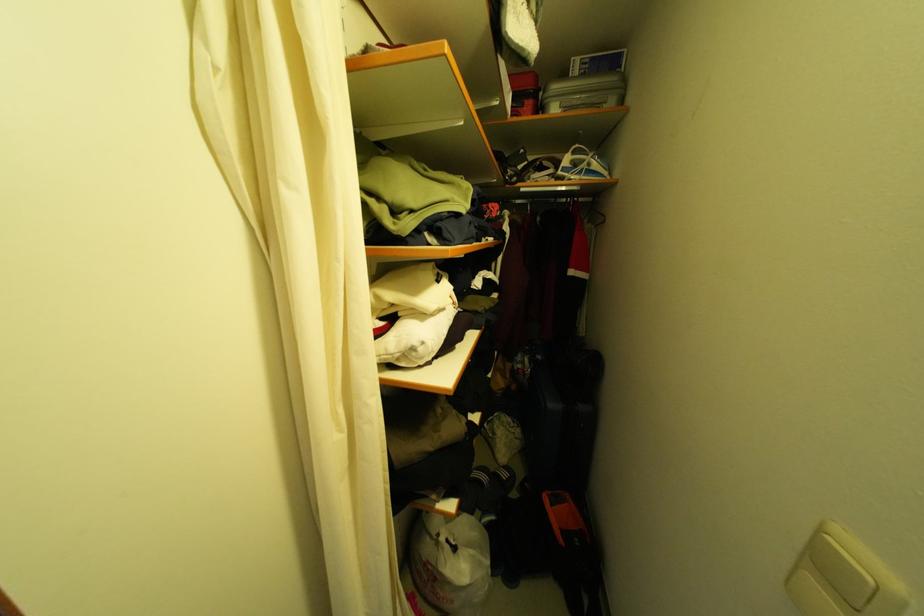
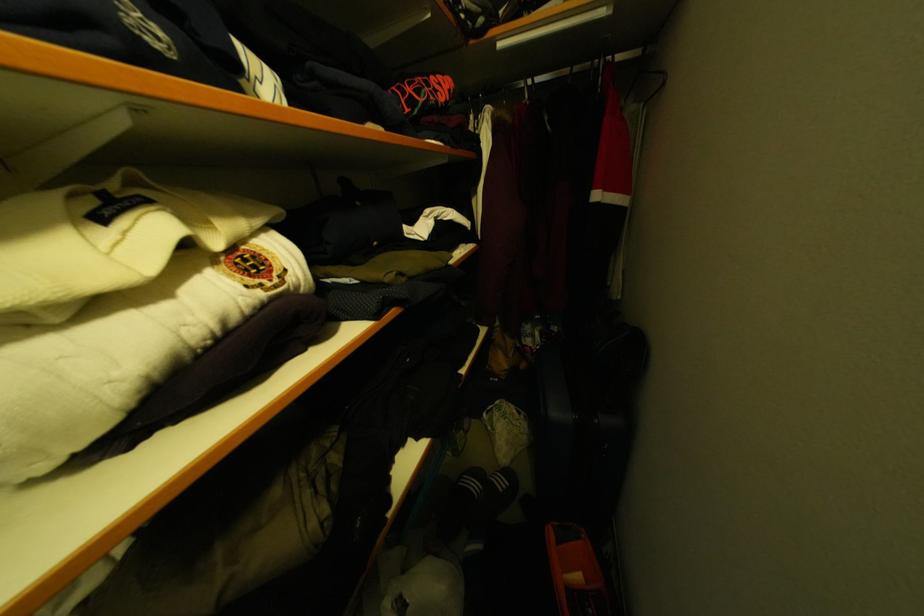
Where in the second image is the point corresponding to pixel 525 190 from the first image?

(500, 43)